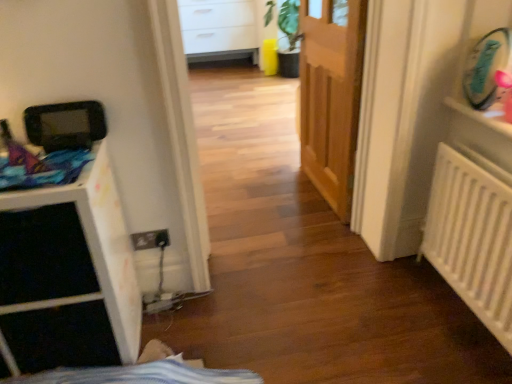
What do you see at coordinates (472, 238) in the screenshot? I see `white matte radiator at right` at bounding box center [472, 238].

Where is `wooden door at center`? This screenshot has width=512, height=384. wooden door at center is located at coordinates (331, 95).

I want to click on white plastic shelf at upper right, so click(x=479, y=116).

Which is behind, point (470, 188) or point (345, 203)?

The point (345, 203) is more distant.

Which object is more forward, white matte radiator at right or wooden door at center?

white matte radiator at right.

Between white matte radiator at right and wooden door at center, which one appears on the right side from the viewer's perspective?

Positioned to the right is white matte radiator at right.

Which of these two, white plastic shelf at upper right or wooden door at center, is smaller?

With smaller size is white plastic shelf at upper right.

Is white plastic shelf at upper right to the left or to the right of wooden door at center in the image?

Clearly, white plastic shelf at upper right is on the right of wooden door at center in the image.

Is point (447, 99) positioned after point (340, 116)?

No, it is not.

Would you consider white plastic shelf at upper right to be distant from wooden door at center?

That's not correct — white plastic shelf at upper right is a little close to wooden door at center.

Which is in front, white matte file cabinet at left or white plastic shelf at upper right?

white matte file cabinet at left is closer to the camera.

Looking at this image, is white matte file cabinet at left taller than white plastic shelf at upper right?

Yes.

What's the angular difference between white matte file cabinet at left and white plastic shelf at upper right's facing directions?

white matte file cabinet at left and white plastic shelf at upper right are facing 90.6 degrees away from each other.

From the image's perspective, between white matte file cabinet at left and white plastic shelf at upper right, which one is located above?

white plastic shelf at upper right, from the image's perspective.

Can you confirm if wooden door at center is bigger than white matte file cabinet at left?

No.

Is the depth of wooden door at center greater than that of white matte file cabinet at left?

Yes, the depth of wooden door at center is greater than that of white matte file cabinet at left.

Is wooden door at center oriented away from white matte file cabinet at left?

No, wooden door at center's orientation is not away from white matte file cabinet at left.

Which is correct: white matte radiator at right is inside white plastic shelf at upper right, or outside of it?

white matte radiator at right cannot be found inside white plastic shelf at upper right.

Considering the positions of points (470, 303) and (495, 126), is point (470, 303) farther from camera compared to point (495, 126)?

Yes, it is.

Is there a large distance between white matte radiator at right and white plastic shelf at upper right?

white matte radiator at right is near white plastic shelf at upper right, not far away.

Is wooden door at center not within white matte radiator at right?

Indeed, wooden door at center is completely outside white matte radiator at right.

Is wooden door at center positioned before white matte radiator at right?

No, the depth of wooden door at center is greater than that of white matte radiator at right.

How far apart are wooden door at center and white matte radiator at right?

wooden door at center and white matte radiator at right are 29.33 inches apart from each other.

Would you consider white plastic shelf at upper right to be distant from white matte file cabinet at left?

Yes, white plastic shelf at upper right and white matte file cabinet at left are quite far apart.

From the image's perspective, is white plastic shelf at upper right over white matte file cabinet at left?

Yes, from the image's perspective, white plastic shelf at upper right is over white matte file cabinet at left.

Consider the image. Do you think white plastic shelf at upper right is within white matte file cabinet at left, or outside of it?

The correct answer is: outside.

In order to click on door behind the white matte radiator at right in this screenshot , I will do `click(331, 95)`.

Where is `door above the white plastic shelf at upper right (from the image's perspective)`? The image size is (512, 384). door above the white plastic shelf at upper right (from the image's perspective) is located at coordinates (331, 95).

From the image, which object appears to be nearer to white matte radiator at right, white matte file cabinet at left or wooden door at center?

wooden door at center is positioned closer to the anchor white matte radiator at right.

When comparing their distances from white matte file cabinet at left, does wooden door at center or white matte radiator at right seem closer?

Based on the image, white matte radiator at right appears to be nearer to white matte file cabinet at left.

Looking at this image, considering their positions, is white plastic shelf at upper right positioned further to white matte radiator at right than wooden door at center?

The object further to white matte radiator at right is wooden door at center.

Looking at the image, which one is located further to white plastic shelf at upper right, white matte radiator at right or wooden door at center?

wooden door at center.

Estimate the real-world distances between objects in this image. Which object is further from wooden door at center, white plastic shelf at upper right or white matte radiator at right?

white plastic shelf at upper right is further to wooden door at center.

When comparing their distances from white plastic shelf at upper right, does wooden door at center or white matte radiator at right seem closer?

Based on the image, white matte radiator at right appears to be nearer to white plastic shelf at upper right.

From the image, which object appears to be nearer to white matte file cabinet at left, white plastic shelf at upper right or wooden door at center?

wooden door at center.

Looking at the image, which one is located closer to white matte radiator at right, wooden door at center or white plastic shelf at upper right?

white plastic shelf at upper right is closer to white matte radiator at right.

At what (x,y) coordinates should I click in order to perform the action: click on door located between white matte file cabinet at left and white matte radiator at right in the left-right direction. Please return your answer as a coordinate pair (x, y). Looking at the image, I should click on (331, 95).

I want to click on door between white matte file cabinet at left and white plastic shelf at upper right, so click(331, 95).

Where is `shelf between wooden door at center and white matte radiator at right in the up-down direction`? This screenshot has width=512, height=384. shelf between wooden door at center and white matte radiator at right in the up-down direction is located at coordinates (479, 116).

Locate an element on the screen. radiator between white matte file cabinet at left and white plastic shelf at upper right is located at coordinates (472, 238).